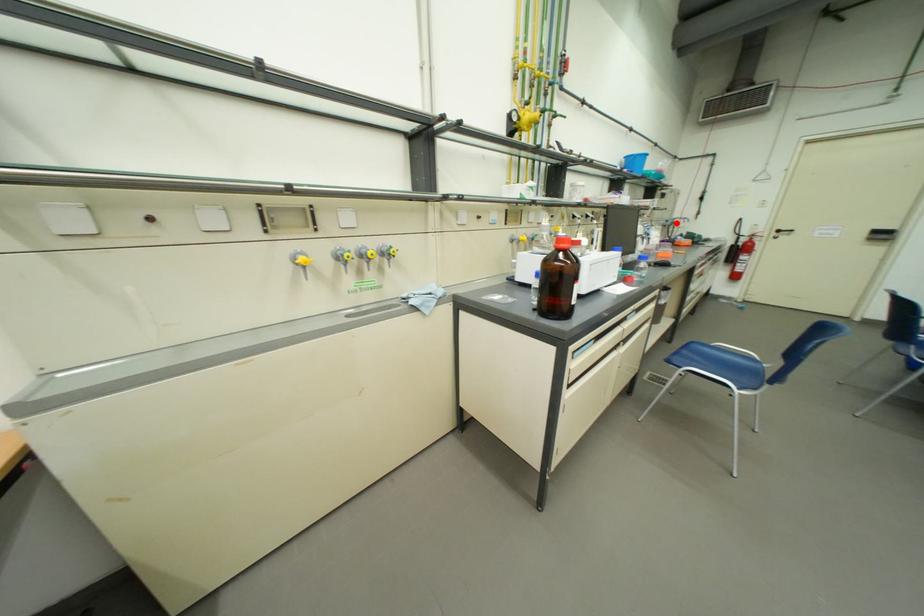
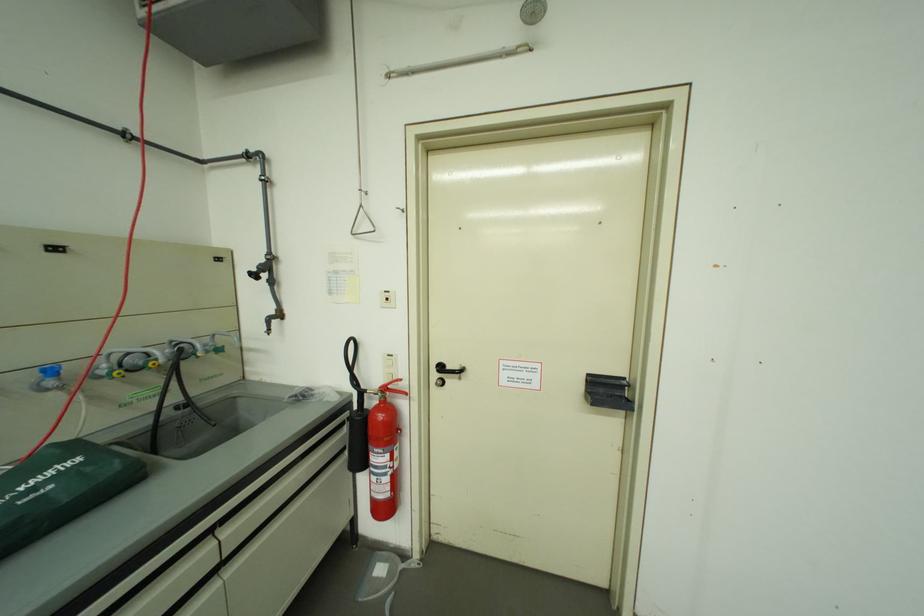
The point at the highlighted location is marked in the first image. Where is the corresponding point in the second image?

(62, 373)